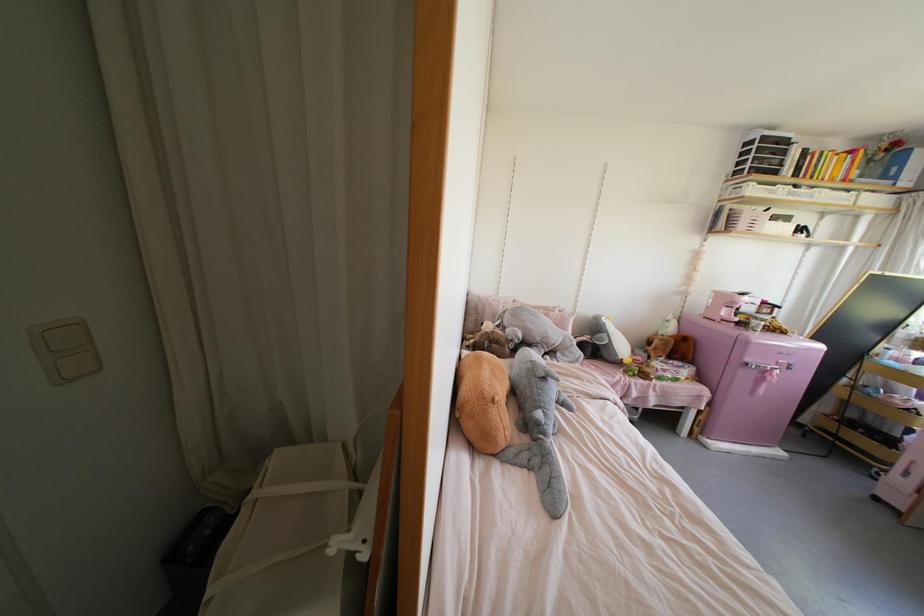
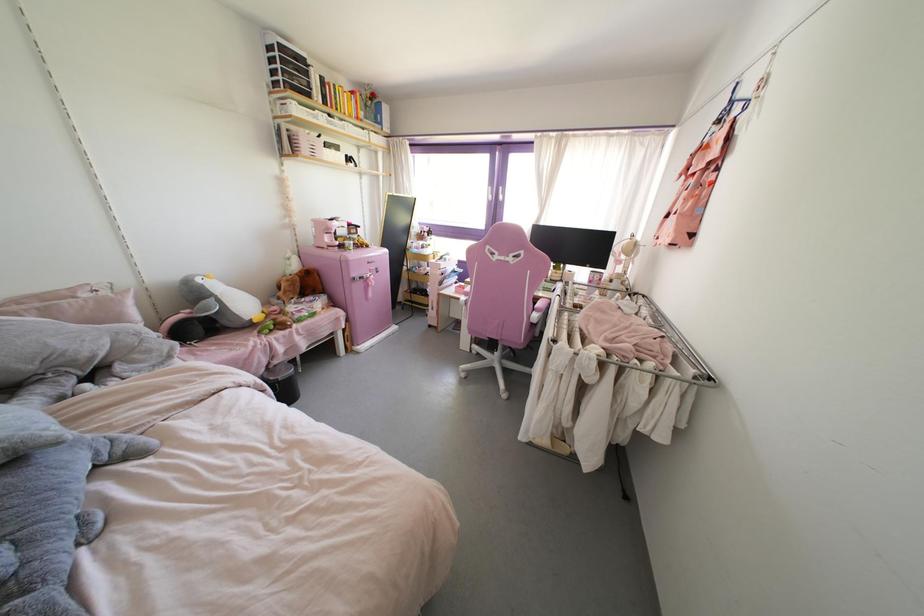
The point at (556,379) is marked in the first image. Where is the corresponding point in the second image?

(57, 442)